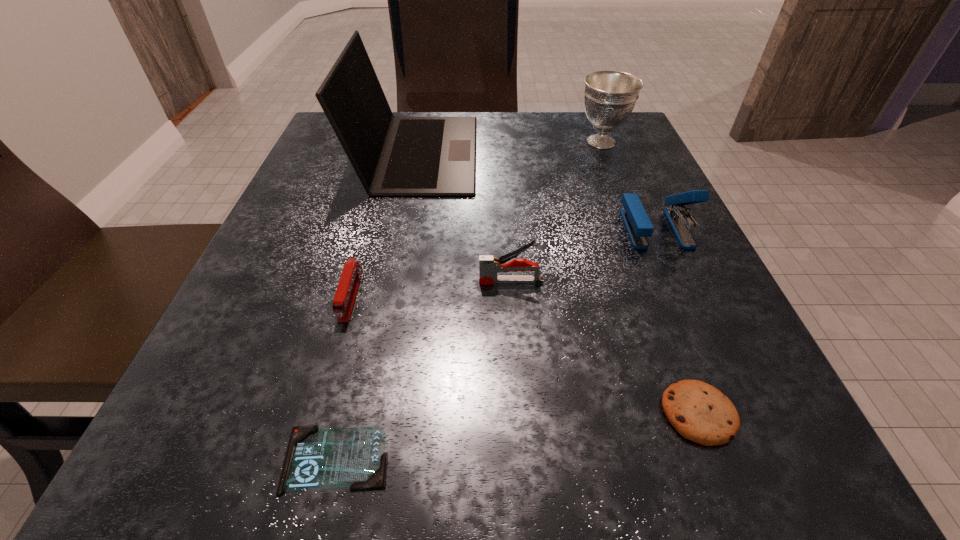
Locate an element on the screen. This screenshot has width=960, height=540. laptop is located at coordinates (393, 156).

At what (x,y) coordinates should I click in order to perform the action: click on chalice. Please return your answer as a coordinate pair (x, y). Looking at the image, I should click on (610, 96).

Locate an element on the screen. The image size is (960, 540). the rightmost stapler is located at coordinates (638, 225).

Where is `the third farthest object`? The height and width of the screenshot is (540, 960). the third farthest object is located at coordinates (638, 225).

Locate an element on the screen. The height and width of the screenshot is (540, 960). the fourth object from right to left is located at coordinates (489, 266).

Identify the location of the fifth tallest object. (346, 293).

Find the location of `the shortest stapler`. the shortest stapler is located at coordinates (346, 293).

This screenshot has width=960, height=540. What are the coordinates of `the second shortest object` in the screenshot? It's located at (699, 412).

You are a GUI agent. You are given a task and a screenshot of the screen. Output one action in this format:
    pyautogui.click(x=<x>, y=<y>)
    Task: Click on the shortest object
    Image resolution: width=960 pixels, height=540 pixels.
    Given the screenshot: What is the action you would take?
    pyautogui.click(x=316, y=458)

Where is `free space located 0.220m on the screen of the tallest object`? The image size is (960, 540). free space located 0.220m on the screen of the tallest object is located at coordinates (581, 153).